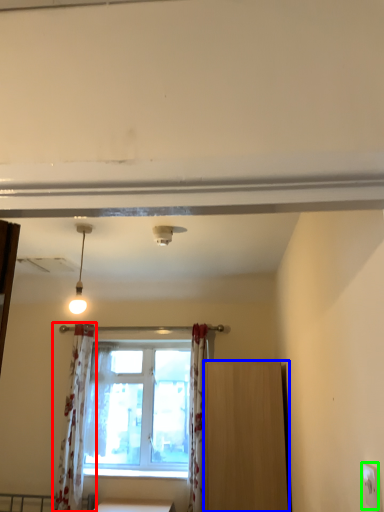
Question: Estimate the real-world distances between objects in this image. Which object is closer to curtain (highlighted by a red box), furniture (highlighted by a blue box) or electric outlet (highlighted by a green box)?

Choices:
 (A) furniture
 (B) electric outlet

Answer: (A)